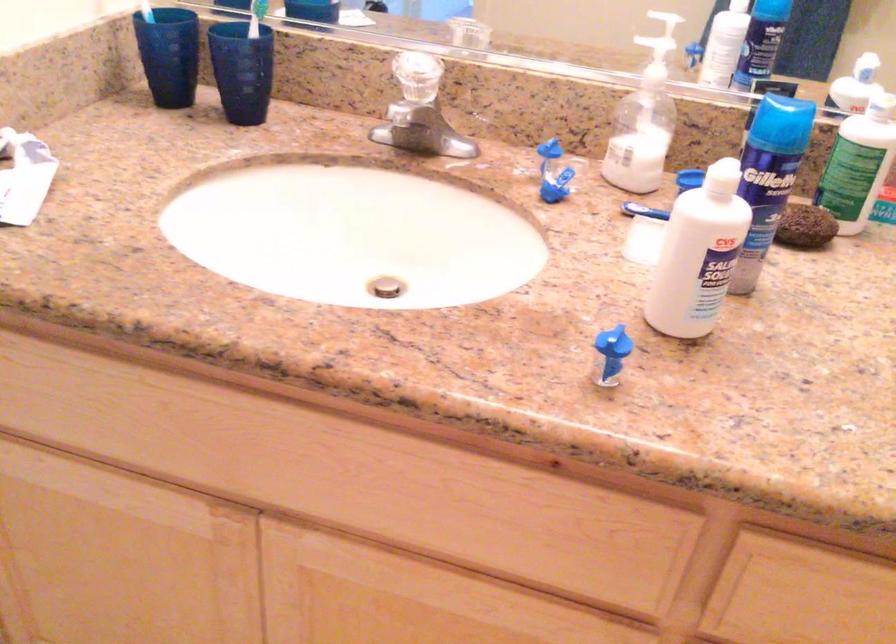
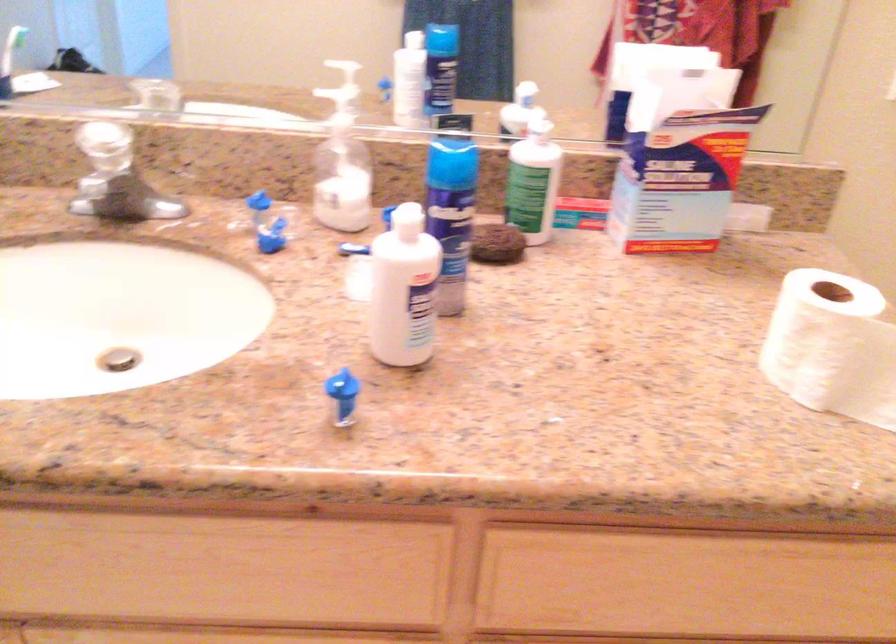
Find the pixel in the second image that matches point 619,344 in the first image.

(341, 386)